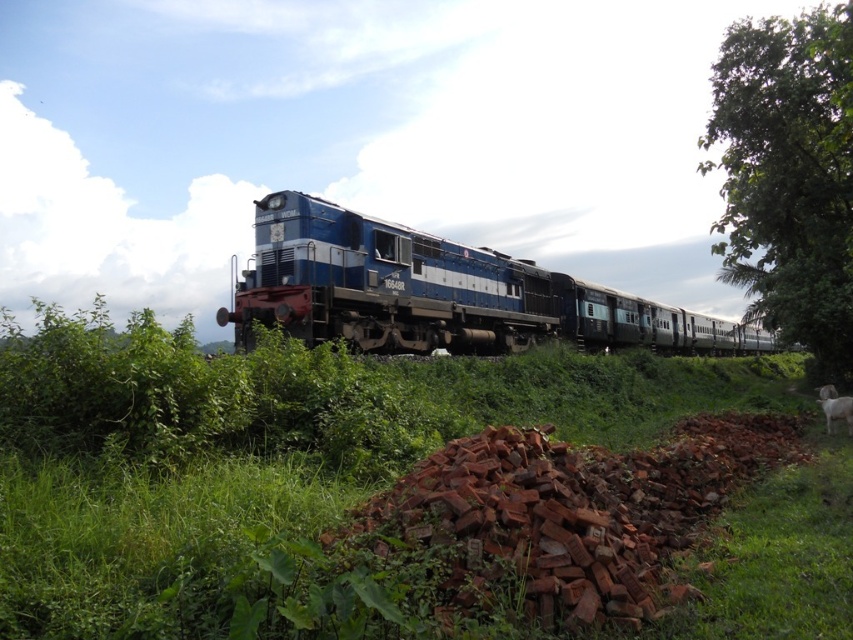
You are a photographer standing at the edge of the grassy area. You want to capture a photo where both the blue metallic train at center and the green leafy tree at right are visible. Based on their heights, which object will appear taller in the photo?

The green leafy tree at right is taller than the blue metallic train at center, so it will appear taller in the photo.

You are standing at the origin point in the scene. Which direction should you move to reach the blue metallic train at center?

You should move towards the coordinates point (x=439, y=292) to reach the blue metallic train at center.

You are a passenger on the blue metallic train at center and want to look out the window to see the green leafy tree at right. Is the tree visible from your current position?

The blue metallic train at center is below green leafy tree at right, so the tree is above the train. Therefore, the green leafy tree at right is visible from the window of the blue metallic train at center.